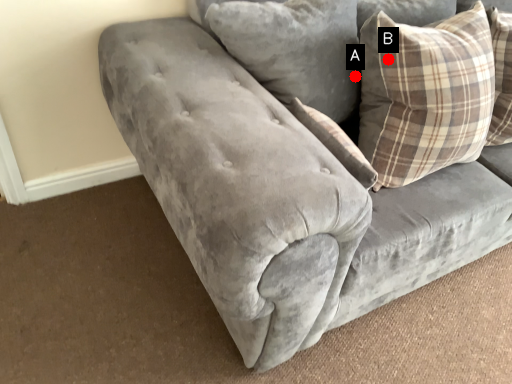
Question: Two points are circled on the image, labeled by A and B beside each circle. Which point is closer to the camera?

Choices:
 (A) A is closer
 (B) B is closer

Answer: (B)